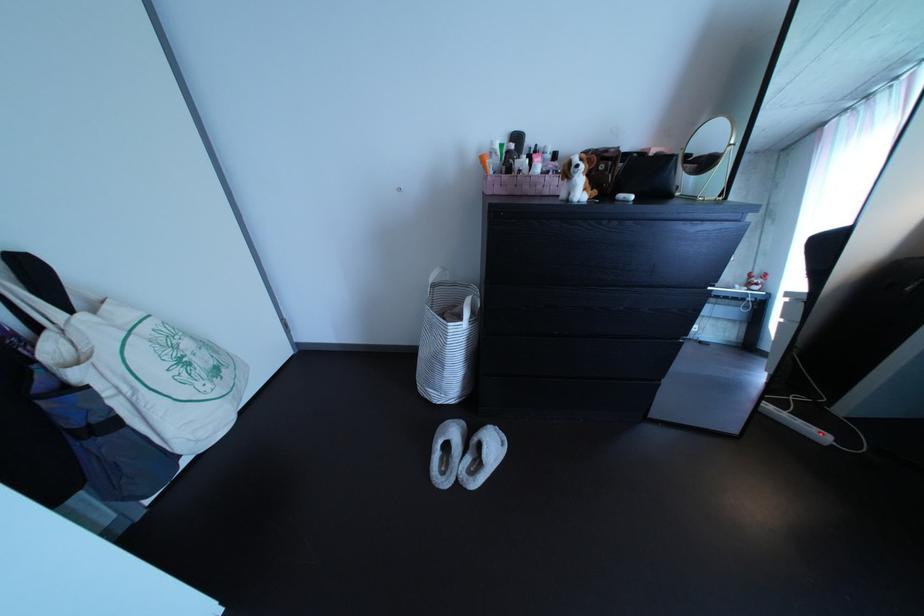
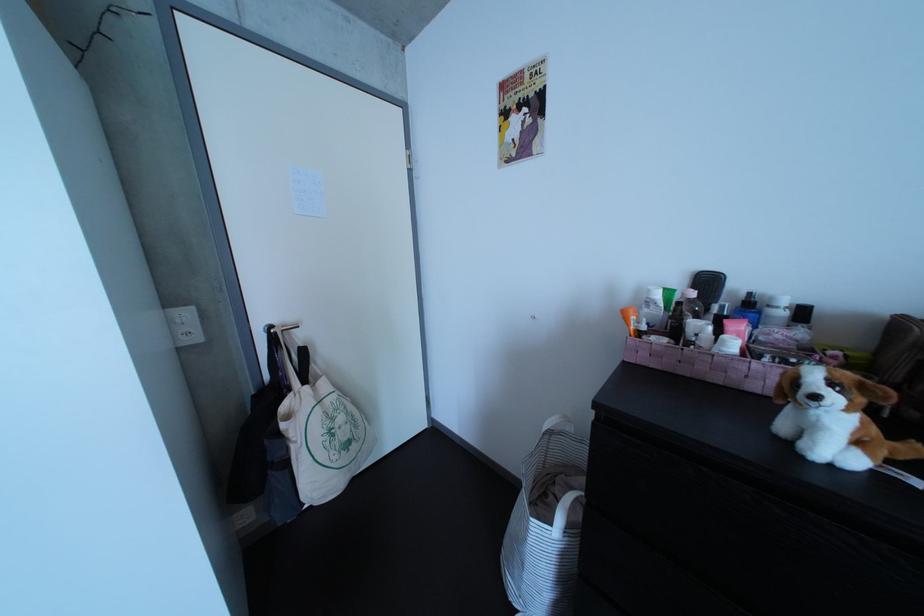
Where in the second image is the point corresponding to (560,180) from the first image?

(764, 362)